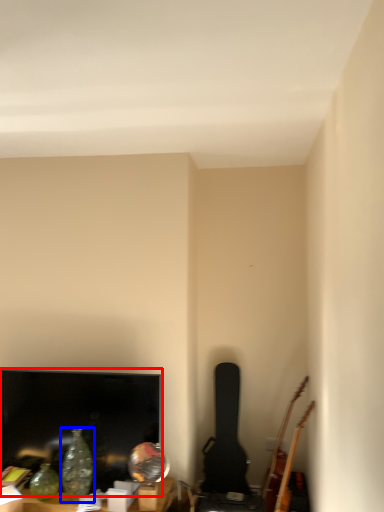
Question: Among these objects, which one is nearest to the camera, television (highlighted by a red box) or glass vase (highlighted by a blue box)?

Choices:
 (A) television
 (B) glass vase

Answer: (B)